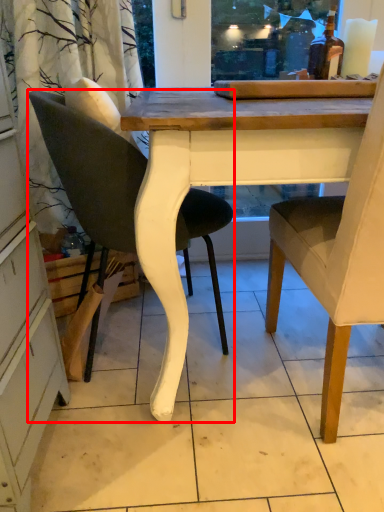
Question: From the image's perspective, where is chair (annotated by the red box) located relative to chair?

Choices:
 (A) below
 (B) above

Answer: (B)